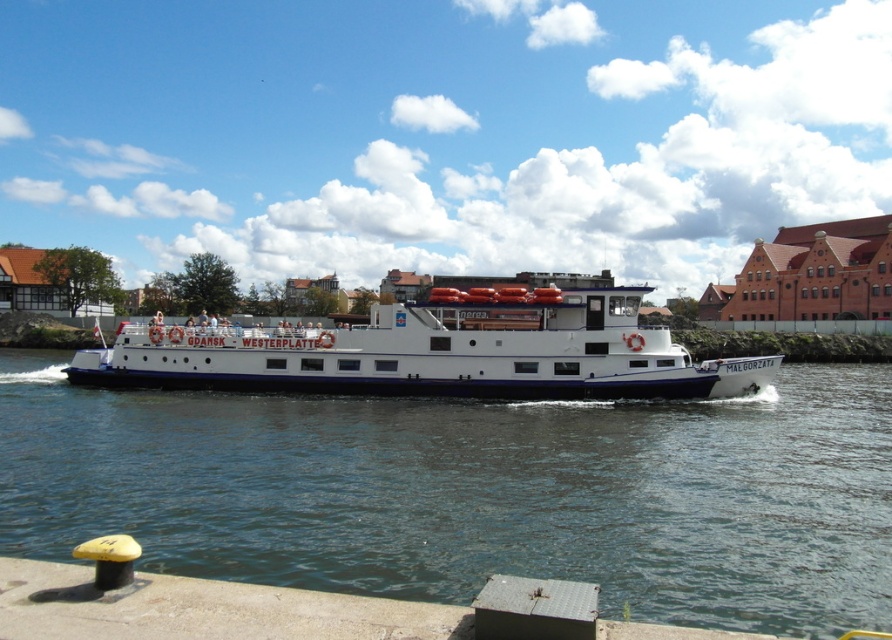
Is clear blue water at center shorter than white matte boat at center?

Indeed, clear blue water at center has a lesser height compared to white matte boat at center.

Does clear blue water at center appear on the left side of white matte boat at center?

Correct, you'll find clear blue water at center to the left of white matte boat at center.

Is point (279, 580) positioned in front of point (439, 326)?

Yes, it is in front of point (439, 326).

Where is `clear blue water at center`? clear blue water at center is located at coordinates (475, 492).